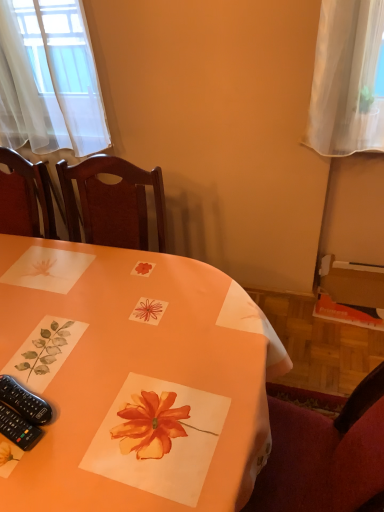
Locate an element on the screen. The image size is (384, 512). black plastic remote control at lower left, positioned as the second remote control in top-to-bottom order is located at coordinates (18, 429).

From a real-world perspective, relative to black plastic remote control at lower left, the first remote control positioned from the bottom, is black plastic remote control at lower left, positioned as the 2th remote control in bottom-to-top order, vertically above or below?

black plastic remote control at lower left, positioned as the 2th remote control in bottom-to-top order, is above black plastic remote control at lower left, the first remote control positioned from the bottom.

From the image's perspective, is black plastic remote control at lower left, positioned as the 2th remote control in bottom-to-top order, positioned above or below black plastic remote control at lower left, positioned as the second remote control in top-to-bottom order?

black plastic remote control at lower left, positioned as the 2th remote control in bottom-to-top order, is above black plastic remote control at lower left, positioned as the second remote control in top-to-bottom order.

Does black plastic remote control at lower left, positioned as the 2th remote control in bottom-to-top order, lie in front of black plastic remote control at lower left, positioned as the second remote control in top-to-bottom order?

No, black plastic remote control at lower left, positioned as the 2th remote control in bottom-to-top order, is further to the viewer.

Based on the photo, are black plastic remote control at lower left, positioned as the 2th remote control in bottom-to-top order, and black plastic remote control at lower left, the first remote control positioned from the bottom, beside each other?

Absolutely, black plastic remote control at lower left, positioned as the 2th remote control in bottom-to-top order, is next to and touching black plastic remote control at lower left, the first remote control positioned from the bottom.

This screenshot has height=512, width=384. Find the location of `table in front of the black plastic remote control at lower left, positioned as the second remote control in top-to-bottom order`. table in front of the black plastic remote control at lower left, positioned as the second remote control in top-to-bottom order is located at coordinates (134, 379).

Is orange paper placemat at center next to black plastic remote control at lower left, positioned as the second remote control in top-to-bottom order?

No, orange paper placemat at center is not beside black plastic remote control at lower left, positioned as the second remote control in top-to-bottom order.

Is the position of orange paper placemat at center more distant than that of black plastic remote control at lower left, the first remote control positioned from the bottom?

No, orange paper placemat at center is in front of black plastic remote control at lower left, the first remote control positioned from the bottom.

Could you tell me if orange paper placemat at center is facing black plastic remote control at lower left, positioned as the second remote control in top-to-bottom order?

No, orange paper placemat at center is not facing towards black plastic remote control at lower left, positioned as the second remote control in top-to-bottom order.

From the image's perspective, between black plastic remote control at lower left, positioned as the second remote control in top-to-bottom order, and black plastic remote control at lower left, which is counted as the first remote control, starting from the top, which one is located above?

From the image's view, black plastic remote control at lower left, which is counted as the first remote control, starting from the top, is above.

Are black plastic remote control at lower left, positioned as the second remote control in top-to-bottom order, and black plastic remote control at lower left, which is counted as the first remote control, starting from the top, located far from each other?

No, black plastic remote control at lower left, positioned as the second remote control in top-to-bottom order, is not far away from black plastic remote control at lower left, which is counted as the first remote control, starting from the top.

In terms of size, does black plastic remote control at lower left, the first remote control positioned from the bottom, appear bigger or smaller than black plastic remote control at lower left, positioned as the 2th remote control in bottom-to-top order?

black plastic remote control at lower left, the first remote control positioned from the bottom, is smaller than black plastic remote control at lower left, positioned as the 2th remote control in bottom-to-top order.

Measure the distance between black plastic remote control at lower left, positioned as the second remote control in top-to-bottom order, and black plastic remote control at lower left, positioned as the 2th remote control in bottom-to-top order.

black plastic remote control at lower left, positioned as the second remote control in top-to-bottom order, and black plastic remote control at lower left, positioned as the 2th remote control in bottom-to-top order, are 1.15 inches apart from each other.

Is orange paper placemat at center smaller than black plastic remote control at lower left, which is counted as the first remote control, starting from the top?

Incorrect, orange paper placemat at center is not smaller in size than black plastic remote control at lower left, which is counted as the first remote control, starting from the top.

Is orange paper placemat at center thinner than black plastic remote control at lower left, which is counted as the first remote control, starting from the top?

Incorrect, the width of orange paper placemat at center is not less than that of black plastic remote control at lower left, which is counted as the first remote control, starting from the top.

Can you see orange paper placemat at center touching black plastic remote control at lower left, which is counted as the first remote control, starting from the top?

orange paper placemat at center is not next to black plastic remote control at lower left, which is counted as the first remote control, starting from the top, and they're not touching.

From a real-world perspective, count 2nd remote controls upward from the orange paper placemat at center and point to it. Please provide its 2D coordinates.

[(24, 401)]

Who is smaller, black plastic remote control at lower left, which is counted as the first remote control, starting from the top, or orange paper placemat at center?

With smaller size is black plastic remote control at lower left, which is counted as the first remote control, starting from the top.

From a real-world perspective, which object stands above the other?

black plastic remote control at lower left, which is counted as the first remote control, starting from the top.

Does black plastic remote control at lower left, positioned as the second remote control in top-to-bottom order, touch orange paper placemat at center?

No, black plastic remote control at lower left, positioned as the second remote control in top-to-bottom order, is not making contact with orange paper placemat at center.

Which object is positioned more to the left, black plastic remote control at lower left, the first remote control positioned from the bottom, or orange paper placemat at center?

orange paper placemat at center.

Does black plastic remote control at lower left, positioned as the second remote control in top-to-bottom order, come behind orange paper placemat at center?

Yes, black plastic remote control at lower left, positioned as the second remote control in top-to-bottom order, is further from the camera.

Considering the sizes of objects black plastic remote control at lower left, the first remote control positioned from the bottom, and orange paper placemat at center in the image provided, who is shorter, black plastic remote control at lower left, the first remote control positioned from the bottom, or orange paper placemat at center?

black plastic remote control at lower left, the first remote control positioned from the bottom, is shorter.

In the image, there is a black plastic remote control at lower left, the first remote control positioned from the bottom. Where is `remote control above it (from the image's perspective)`? Image resolution: width=384 pixels, height=512 pixels. remote control above it (from the image's perspective) is located at coordinates (24, 401).

Find the location of a particular element. Image resolution: width=384 pixels, height=512 pixels. table lying in front of the black plastic remote control at lower left, the first remote control positioned from the bottom is located at coordinates (134, 379).

When comparing their distances from black plastic remote control at lower left, positioned as the second remote control in top-to-bottom order, does orange paper placemat at center or black plastic remote control at lower left, which is counted as the first remote control, starting from the top, seem closer?

black plastic remote control at lower left, which is counted as the first remote control, starting from the top, lies closer to black plastic remote control at lower left, positioned as the second remote control in top-to-bottom order, than the other object.

Considering their positions, is orange paper placemat at center positioned further to black plastic remote control at lower left, which is counted as the first remote control, starting from the top, than black plastic remote control at lower left, positioned as the second remote control in top-to-bottom order?

Based on the image, orange paper placemat at center appears to be further to black plastic remote control at lower left, which is counted as the first remote control, starting from the top.

Which object lies nearer to the anchor point orange paper placemat at center, black plastic remote control at lower left, positioned as the second remote control in top-to-bottom order, or black plastic remote control at lower left, positioned as the 2th remote control in bottom-to-top order?

black plastic remote control at lower left, positioned as the 2th remote control in bottom-to-top order, lies closer to orange paper placemat at center than the other object.

When comparing their distances from black plastic remote control at lower left, which is counted as the first remote control, starting from the top, does black plastic remote control at lower left, positioned as the second remote control in top-to-bottom order, or orange paper placemat at center seem further?

Based on the image, orange paper placemat at center appears to be further to black plastic remote control at lower left, which is counted as the first remote control, starting from the top.

Based on their spatial positions, is black plastic remote control at lower left, which is counted as the first remote control, starting from the top, or black plastic remote control at lower left, the first remote control positioned from the bottom, closer to orange paper placemat at center?

Among the two, black plastic remote control at lower left, which is counted as the first remote control, starting from the top, is located nearer to orange paper placemat at center.

When comparing their distances from black plastic remote control at lower left, the first remote control positioned from the bottom, does black plastic remote control at lower left, which is counted as the first remote control, starting from the top, or orange paper placemat at center seem further?

orange paper placemat at center is further to black plastic remote control at lower left, the first remote control positioned from the bottom.

This screenshot has height=512, width=384. In order to click on remote control between orange paper placemat at center and black plastic remote control at lower left, which is counted as the first remote control, starting from the top, from front to back in this screenshot , I will do `click(18, 429)`.